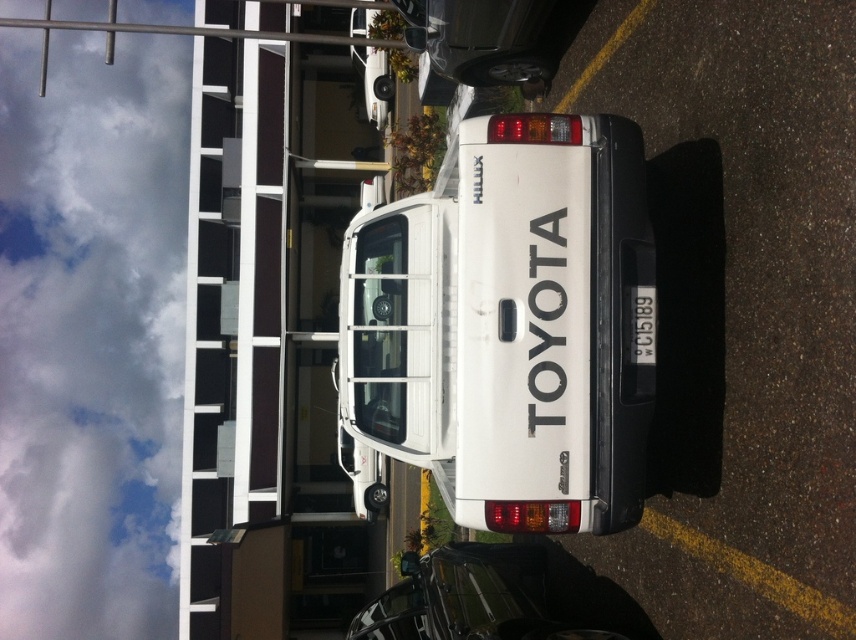
Question: Does glossy black car at lower right appear on the left side of white plastic license plate at center?

Choices:
 (A) no
 (B) yes

Answer: (B)

Question: Which of the following is the closest to the observer?

Choices:
 (A) white plastic license plate at center
 (B) glossy black car at lower right

Answer: (A)

Question: Which of the following is the closest to the observer?

Choices:
 (A) (369, 625)
 (B) (402, 296)

Answer: (B)

Question: Does white matte truck at center appear over glossy black car at lower right?

Choices:
 (A) no
 (B) yes

Answer: (B)

Question: Can you confirm if white matte truck at center is positioned to the left of glossy black car at lower right?

Choices:
 (A) yes
 (B) no

Answer: (A)

Question: Which point is closer to the camera taking this photo?

Choices:
 (A) tap(369, 403)
 (B) tap(648, 320)
 (C) tap(455, 620)

Answer: (B)